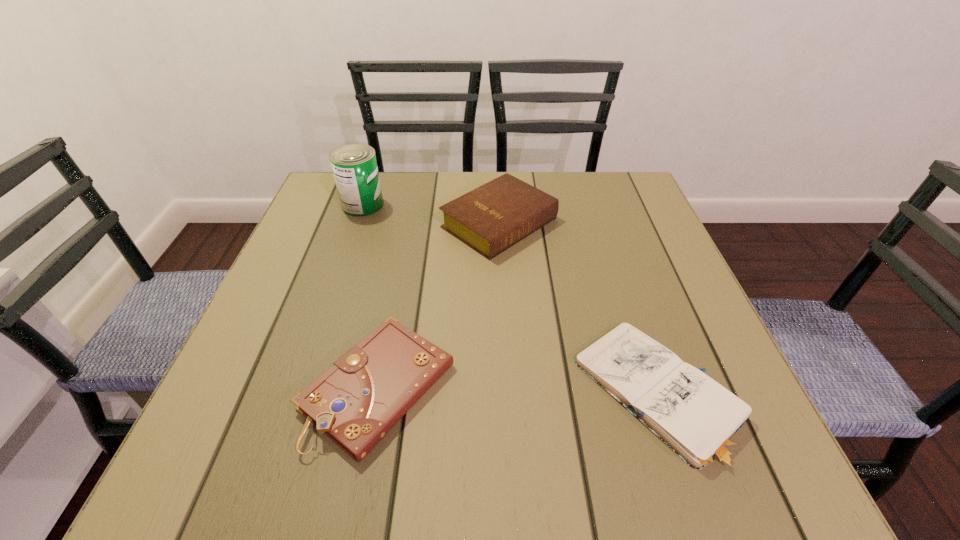
The width and height of the screenshot is (960, 540). I want to click on can present at the far edge, so click(354, 166).

Where is `Bible that is at the far edge`? Bible that is at the far edge is located at coordinates (490, 219).

This screenshot has width=960, height=540. Identify the location of can at the left edge. (354, 166).

This screenshot has height=540, width=960. In order to click on notebook that is at the left edge in this screenshot , I will do `click(355, 402)`.

The width and height of the screenshot is (960, 540). Identify the location of object located in the right edge section of the desktop. pyautogui.click(x=699, y=419).

You are a GUI agent. You are given a task and a screenshot of the screen. Output one action in this format:
    pyautogui.click(x=<x>, y=<y>)
    Task: Click on the object positioned at the far left corner
    This screenshot has height=540, width=960.
    Given the screenshot: What is the action you would take?
    pyautogui.click(x=354, y=166)

Locate an element on the screen. object situated at the near left corner is located at coordinates (355, 402).

At what (x,y) coordinates should I click in order to perform the action: click on object that is at the near right corner. Please return your answer as a coordinate pair (x, y). Looking at the image, I should click on (699, 419).

This screenshot has width=960, height=540. In order to click on vacant space at the far edge of the desktop in this screenshot , I will do `click(406, 171)`.

You are a GUI agent. You are given a task and a screenshot of the screen. Output one action in this format:
    pyautogui.click(x=<x>, y=<y>)
    Task: Click on the vacant space at the near edge of the desktop
    The image size is (960, 540).
    Given the screenshot: What is the action you would take?
    pyautogui.click(x=461, y=433)